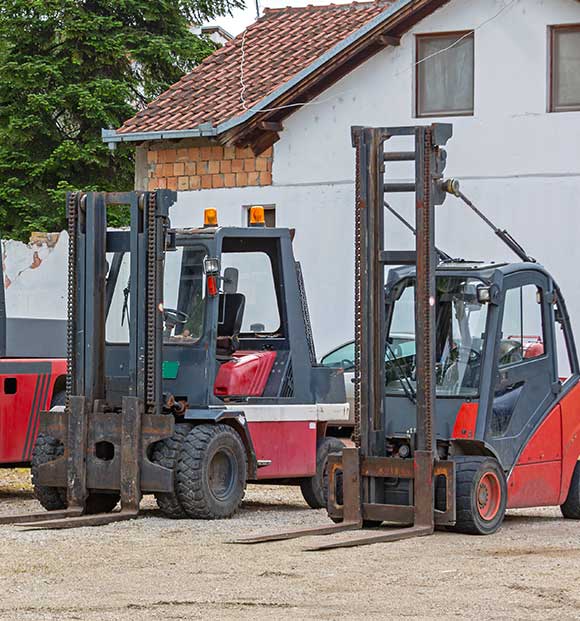
Image resolution: width=580 pixels, height=621 pixels. Find the location of `windows`. windows is located at coordinates (464, 92), (563, 71).